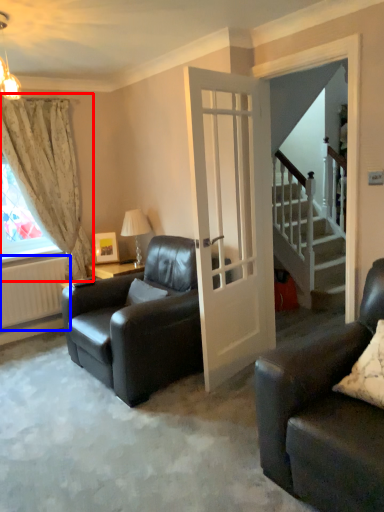
Question: Which object is closer to the camera taking this photo, curtain (highlighted by a red box) or radiator (highlighted by a blue box)?

Choices:
 (A) curtain
 (B) radiator

Answer: (A)